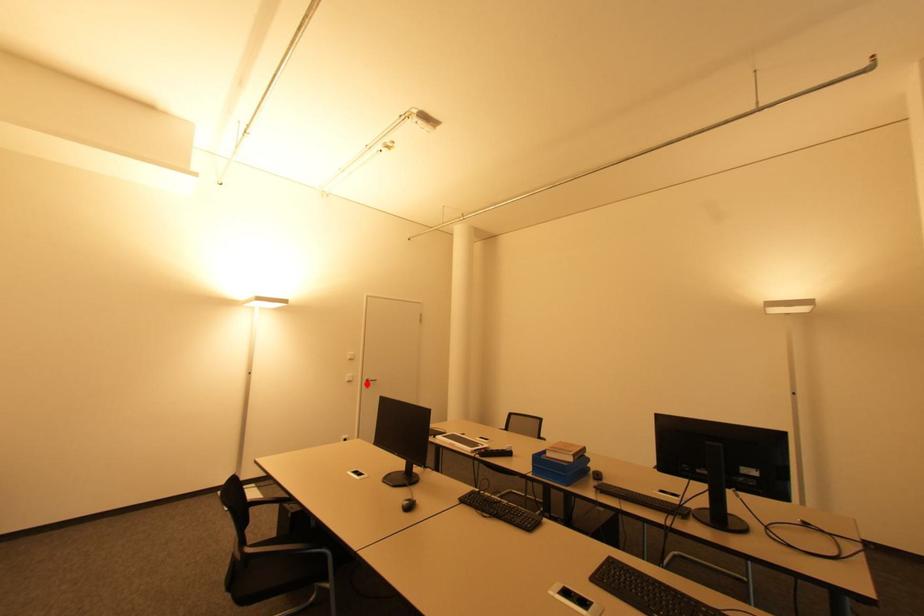
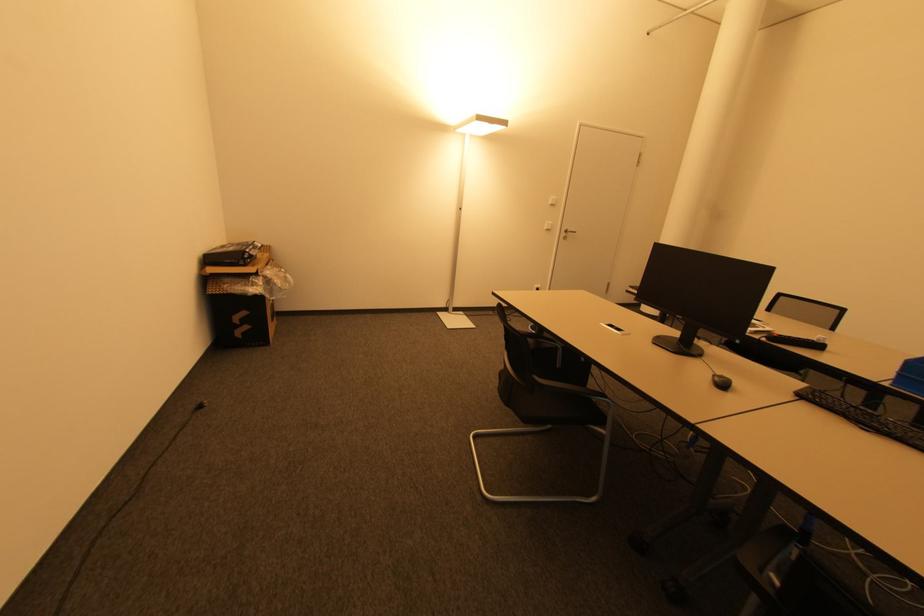
The point at the highlighted location is marked in the first image. Where is the corresponding point in the second image?

(565, 235)